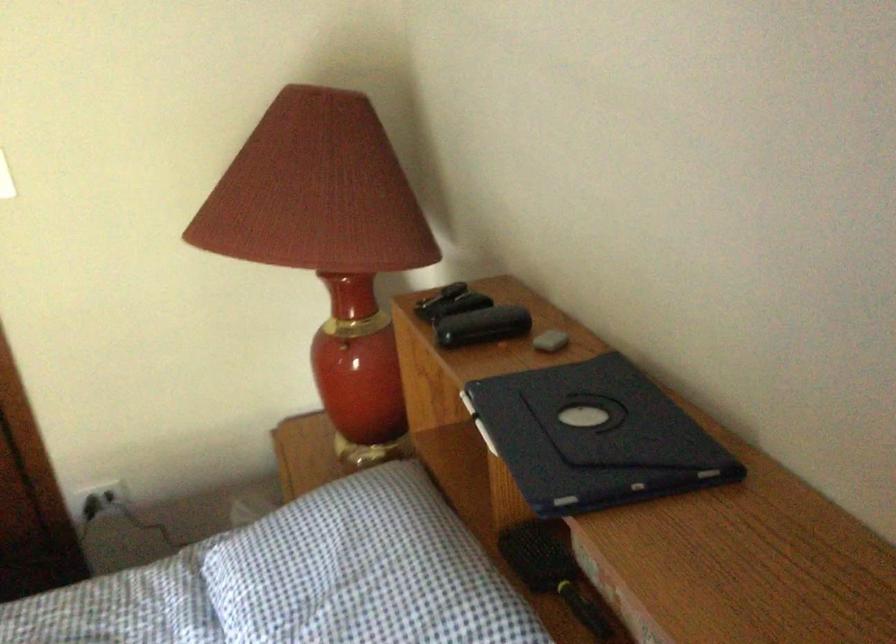
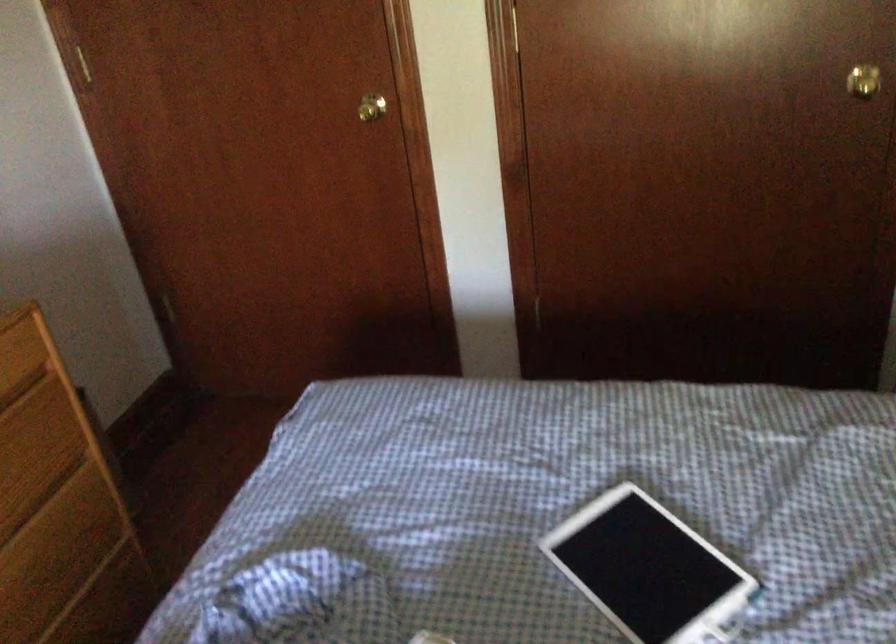
Question: The camera is either moving clockwise (left) or counter-clockwise (right) around the object. The first image is from the beginning of the video and the second image is from the end. Is the camera moving left or right when shooting the video?

Choices:
 (A) Left
 (B) Right

Answer: (B)